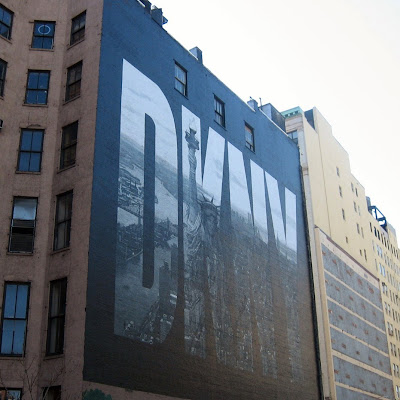
Identify the location of space between windows on wall with the mural wall painting. The height and width of the screenshot is (400, 400). (191, 91), (211, 105), (201, 98), (227, 125), (235, 130), (242, 133).